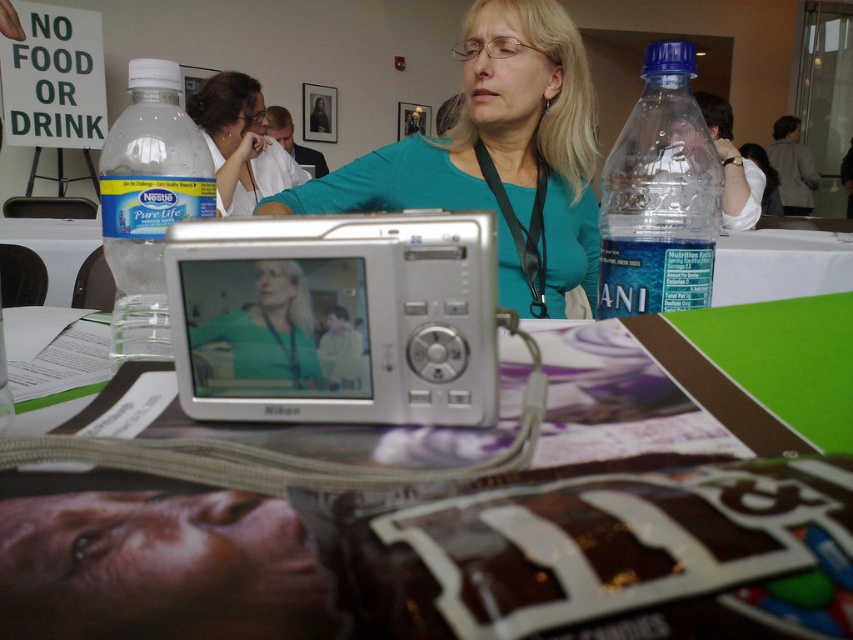
Question: Which of the following is the farthest from the observer?

Choices:
 (A) (183, 196)
 (B) (563, 257)

Answer: (B)

Question: Among these objects, which one is nearest to the camera?

Choices:
 (A) blue translucent bottle at left
 (B) teal fabric shirt at center

Answer: (A)

Question: Which object is the farthest from the blue translucent bottle at upper right?

Choices:
 (A) teal fabric shirt at center
 (B) matte white shirt at upper center
 (C) matte green shirt at center

Answer: (B)

Question: Can you confirm if matte green shirt at center is thinner than matte white shirt at upper center?

Choices:
 (A) yes
 (B) no

Answer: (A)

Question: From the image, what is the correct spatial relationship of teal fabric shirt at center in relation to blue translucent bottle at upper right?

Choices:
 (A) left
 (B) right

Answer: (A)

Question: Can you confirm if blue translucent bottle at left is positioned above matte green shirt at center?

Choices:
 (A) no
 (B) yes

Answer: (B)